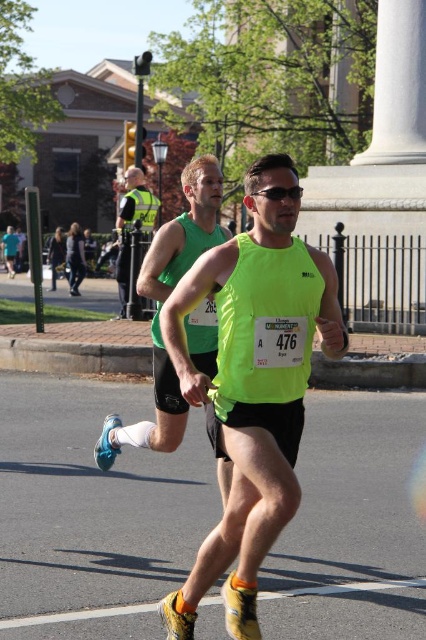
You are a race official trying to determine the current position of two runners in the marathon. The first runner is at point [236,387] and the second runner is at point [152,205]. Based on their positions, which runner is ahead in the race?

Point [236,387] is in front of point [152,205], so the first runner at point [236,387] is ahead in the race.

You are a photographer at the marathon event and want to capture a clear shot of both the neon yellow tank top at center and the reflective yellow vest at center. Which object should you focus on first to ensure it appears larger in the photo?

The reflective yellow vest at center should be focused on first because it has a greater height than the neon yellow tank top at center, making it naturally appear larger in the photo.